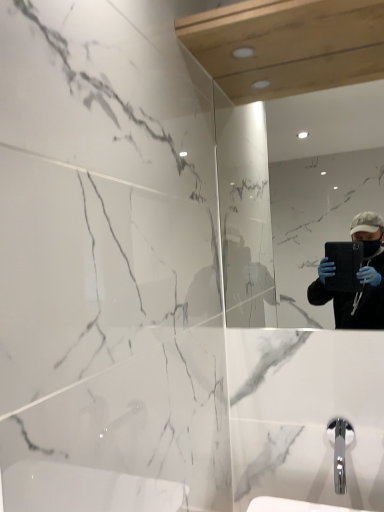
This screenshot has width=384, height=512. Identify the location of matte black tablet at right. pyautogui.click(x=283, y=217).

Measure the distance between point (239,111) and camera.

The depth of point (239,111) is 4.62 feet.

Describe the element at coordinates (283, 217) in the screenshot. I see `matte black tablet at right` at that location.

What is the approximate height of chrome metallic faucet at lower right?

The height of chrome metallic faucet at lower right is 5.94 inches.

The width and height of the screenshot is (384, 512). Describe the element at coordinates (340, 450) in the screenshot. I see `chrome metallic faucet at lower right` at that location.

The image size is (384, 512). What are the coordinates of `chrome metallic faucet at lower right` in the screenshot? It's located at (340, 450).

What is the approximate width of chrome metallic faucet at lower right?

chrome metallic faucet at lower right is 8.07 inches wide.

In order to face chrome metallic faucet at lower right, should I rotate leftwards or rightwards?

Rotate your view right by about 19.180°.

Identify the location of matte black tablet at right. The image size is (384, 512). (283, 217).

Considering the positions of objects chrome metallic faucet at lower right and matte black tablet at right in the image provided, who is more to the right, chrome metallic faucet at lower right or matte black tablet at right?

Positioned to the right is chrome metallic faucet at lower right.

Relative to matte black tablet at right, is chrome metallic faucet at lower right in front or behind?

In the image, chrome metallic faucet at lower right appears in front of matte black tablet at right.

Which is nearer, (340, 489) or (326, 159)?

Point (340, 489) is positioned closer to the camera compared to point (326, 159).

From the image's perspective, which object appears higher, chrome metallic faucet at lower right or matte black tablet at right?

matte black tablet at right.

Based on the photo, from a real-world perspective, is chrome metallic faucet at lower right below matte black tablet at right?

Yes.

Considering the relative sizes of chrome metallic faucet at lower right and matte black tablet at right in the image provided, is chrome metallic faucet at lower right thinner than matte black tablet at right?

No.

Who is shorter, chrome metallic faucet at lower right or matte black tablet at right?

chrome metallic faucet at lower right.

Considering the relative sizes of chrome metallic faucet at lower right and matte black tablet at right in the image provided, is chrome metallic faucet at lower right smaller than matte black tablet at right?

Yes.

In the scene shown: Can matte black tablet at right be found inside chrome metallic faucet at lower right?

No, matte black tablet at right is not surrounded by chrome metallic faucet at lower right.

Is chrome metallic faucet at lower right not close to matte black tablet at right?

Yes.

Is chrome metallic faucet at lower right oriented away from matte black tablet at right?

No, chrome metallic faucet at lower right's orientation is not away from matte black tablet at right.

How different are the orientations of chrome metallic faucet at lower right and matte black tablet at right in degrees?

The angle between the facing direction of chrome metallic faucet at lower right and the facing direction of matte black tablet at right is 0.605 degrees.

Identify the location of mirror on the left of chrome metallic faucet at lower right. The image size is (384, 512). [283, 217].

Does matte black tablet at right appear on the left side of chrome metallic faucet at lower right?

Yes, matte black tablet at right is to the left of chrome metallic faucet at lower right.

Which object is closer to the camera, matte black tablet at right or chrome metallic faucet at lower right?

chrome metallic faucet at lower right is more forward.

Which is farther, (281, 219) or (351, 426)?

Point (281, 219)

From the image's perspective, is matte black tablet at right located beneath chrome metallic faucet at lower right?

Actually, matte black tablet at right appears above chrome metallic faucet at lower right in the image.

From a real-world perspective, is matte black tablet at right above or below chrome metallic faucet at lower right?

From a real-world perspective, matte black tablet at right is physically above chrome metallic faucet at lower right.

Can you confirm if matte black tablet at right is thinner than chrome metallic faucet at lower right?

Yes.

Can you confirm if matte black tablet at right is shorter than chrome metallic faucet at lower right?

No, matte black tablet at right is not shorter than chrome metallic faucet at lower right.

Considering the sizes of matte black tablet at right and chrome metallic faucet at lower right in the image, is matte black tablet at right bigger or smaller than chrome metallic faucet at lower right?

In the image, matte black tablet at right appears to be larger than chrome metallic faucet at lower right.

Is matte black tablet at right completely or partially outside of chrome metallic faucet at lower right?

matte black tablet at right is positioned outside chrome metallic faucet at lower right.

Is there a large distance between matte black tablet at right and chrome metallic faucet at lower right?

matte black tablet at right is far away from chrome metallic faucet at lower right.

Is matte black tablet at right aimed at chrome metallic faucet at lower right?

No, matte black tablet at right does not turn towards chrome metallic faucet at lower right.

This screenshot has width=384, height=512. I want to click on mirror above the chrome metallic faucet at lower right (from a real-world perspective), so click(283, 217).

What are the coordinates of `mirror that is above the chrome metallic faucet at lower right (from the image's perspective)` in the screenshot? It's located at (283, 217).

At what (x,y) coordinates should I click in order to perform the action: click on tap below the matte black tablet at right (from a real-world perspective). Please return your answer as a coordinate pair (x, y). This screenshot has width=384, height=512. Looking at the image, I should click on (340, 450).